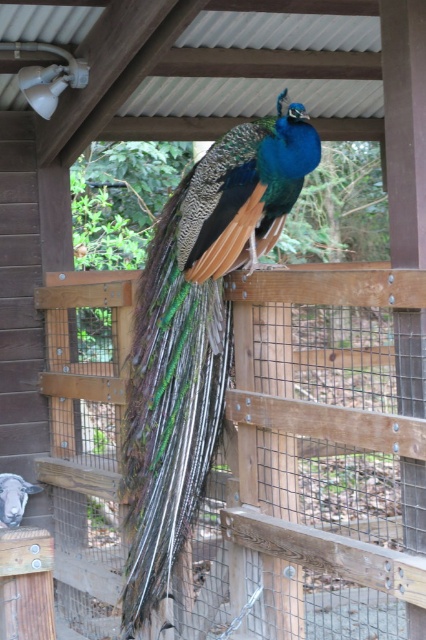
Is wooden fence at center below shiny iridescent peacock at center?

Correct, wooden fence at center is located below shiny iridescent peacock at center.

Is wooden fence at center shorter than shiny iridescent peacock at center?

Yes, wooden fence at center is shorter than shiny iridescent peacock at center.

Between point (293, 348) and point (169, 390), which one is positioned behind?

The point (293, 348) is more distant.

The height and width of the screenshot is (640, 426). I want to click on wooden fence at center, so click(x=313, y=465).